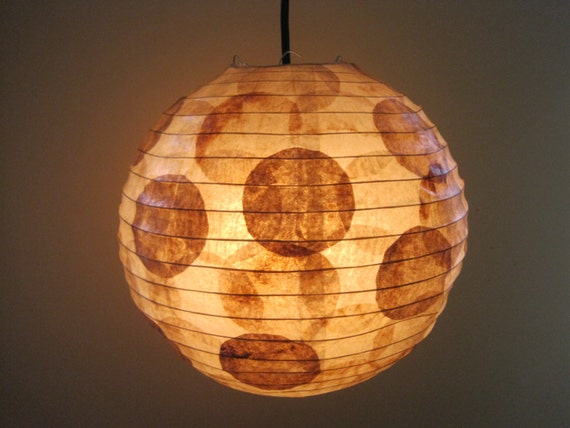
Locate an element on the screen. The height and width of the screenshot is (428, 570). orange glow radiating from lantern is located at coordinates (111, 181).